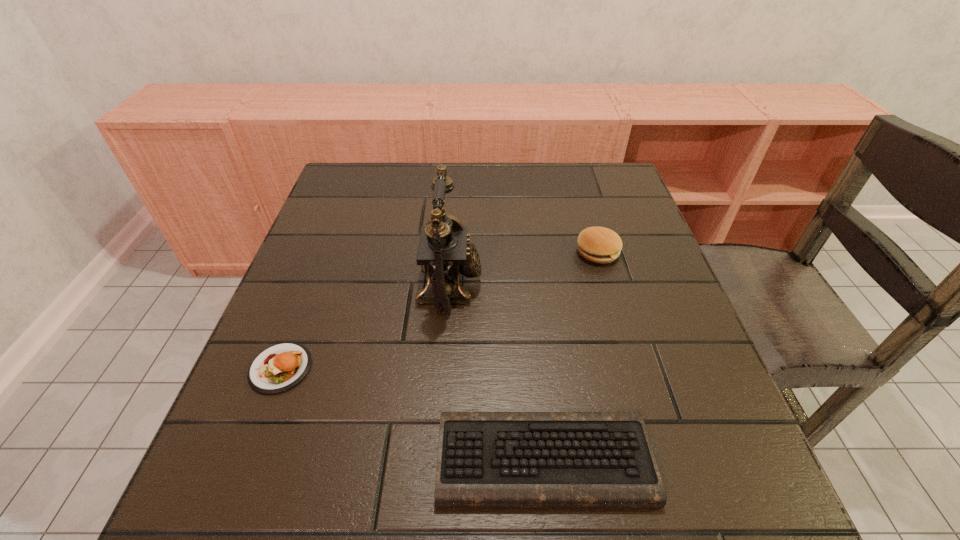
This screenshot has height=540, width=960. Identify the location of object identified as the third closest to the tallest object. (601, 245).

Locate an element on the screen. This screenshot has height=540, width=960. object that is the third closest one to the third farthest object is located at coordinates (601, 245).

This screenshot has height=540, width=960. I want to click on vacant area in the image that satisfies the following two spatial constraints: 1. on the front side of the taller patty (food); 2. on the rotary dial of the tallest object, so click(607, 284).

Find the location of a particular element. Image resolution: width=960 pixels, height=540 pixels. vacant space that satisfies the following two spatial constraints: 1. on the back side of the computer keyboard; 2. on the right side of the farther patty (food) is located at coordinates (522, 252).

You are a GUI agent. You are given a task and a screenshot of the screen. Output one action in this format:
    pyautogui.click(x=<x>, y=<y>)
    Task: Click on the vacant space that satisfies the following two spatial constraints: 1. on the rotary dial of the tallest object; 2. on the left side of the nearest object
    
    Given the screenshot: What is the action you would take?
    pyautogui.click(x=438, y=458)

Find the location of a particular element. This screenshot has width=960, height=540. free space that satisfies the following two spatial constraints: 1. on the front side of the farther patty (food); 2. on the rotary dial of the tallest object is located at coordinates (607, 284).

The height and width of the screenshot is (540, 960). Find the location of `vacant space that satisfies the following two spatial constraints: 1. on the rotary dial of the telephone; 2. on the right side of the computer keyboard`. vacant space that satisfies the following two spatial constraints: 1. on the rotary dial of the telephone; 2. on the right side of the computer keyboard is located at coordinates (438, 458).